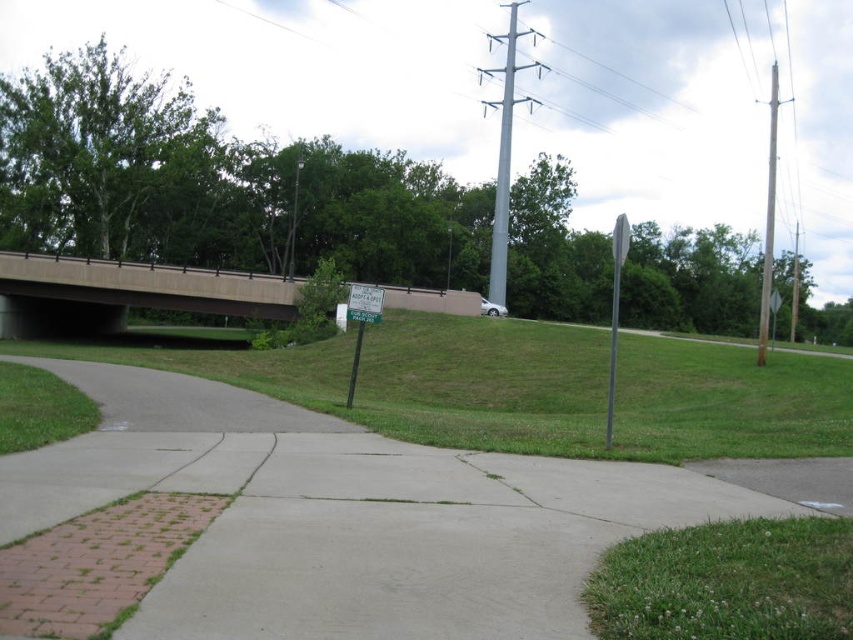
Does green grass at lower right lie behind green plastic sign at center?

No, it is in front of green plastic sign at center.

Does green grass at lower right have a lesser width compared to green plastic sign at center?

Indeed, green grass at lower right has a lesser width compared to green plastic sign at center.

Is point (747, 557) behind point (379, 307)?

No, (747, 557) is closer to viewer.

Identify the location of green grass at lower right. The width and height of the screenshot is (853, 640). (727, 580).

Does concrete at center have a greater width compared to metallic gray sign at right?

No.

Between point (183, 435) and point (614, 328), which one is positioned in front?

Point (183, 435) is more forward.

I want to click on concrete at center, so click(x=357, y=531).

Does point (775, 74) come closer to viewer compared to point (357, 308)?

No, (775, 74) is further to viewer.

Between wooden utility pole at upper right and green plastic sign at center, which one is positioned lower?

Positioned lower is green plastic sign at center.

Is point (775, 96) farther from camera compared to point (358, 333)?

Yes, it is.

Identify the location of wooden utility pole at upper right. (769, 220).